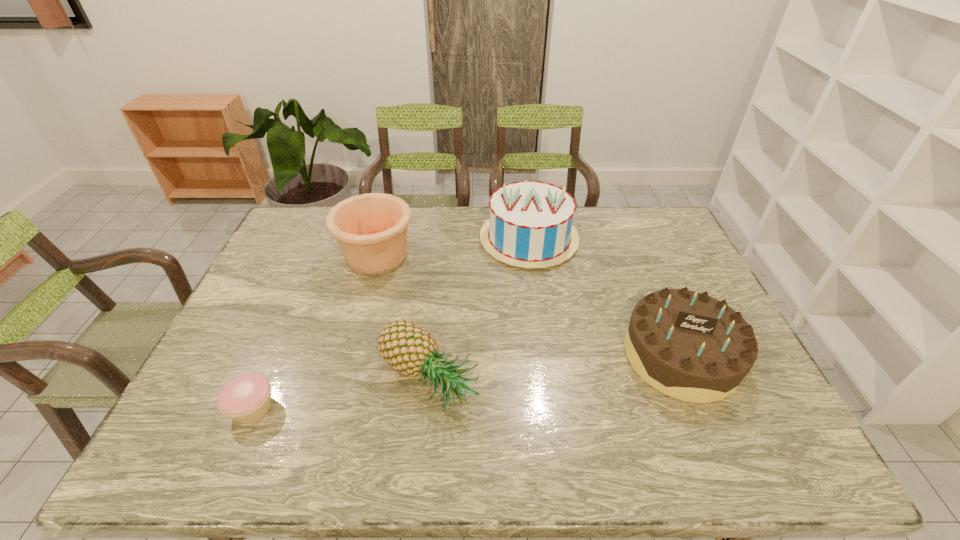
The width and height of the screenshot is (960, 540). I want to click on the left birthday cake, so click(530, 223).

Locate an element on the screen. the farther birthday cake is located at coordinates (530, 223).

Locate an element on the screen. This screenshot has height=540, width=960. pottery is located at coordinates (371, 229).

Image resolution: width=960 pixels, height=540 pixels. Find the location of `the right birthday cake`. the right birthday cake is located at coordinates (687, 345).

The height and width of the screenshot is (540, 960). I want to click on the nearer birthday cake, so click(x=687, y=345).

Where is `pineapple`? The image size is (960, 540). pineapple is located at coordinates (406, 346).

Where is `the shortest object`? Image resolution: width=960 pixels, height=540 pixels. the shortest object is located at coordinates (246, 398).

Locate an element on the screen. cupcake is located at coordinates (246, 398).

You are a GUI agent. You are given a task and a screenshot of the screen. Output one action in this format:
    pyautogui.click(x=<x>, y=<y>)
    Task: Click on the vacant position located 0.350m on the right of the taller birthday cake
    
    Given the screenshot: What is the action you would take?
    pyautogui.click(x=677, y=239)

Identify the location of vacant space situated 0.110m on the right of the pottery. This screenshot has height=540, width=960. (448, 257).